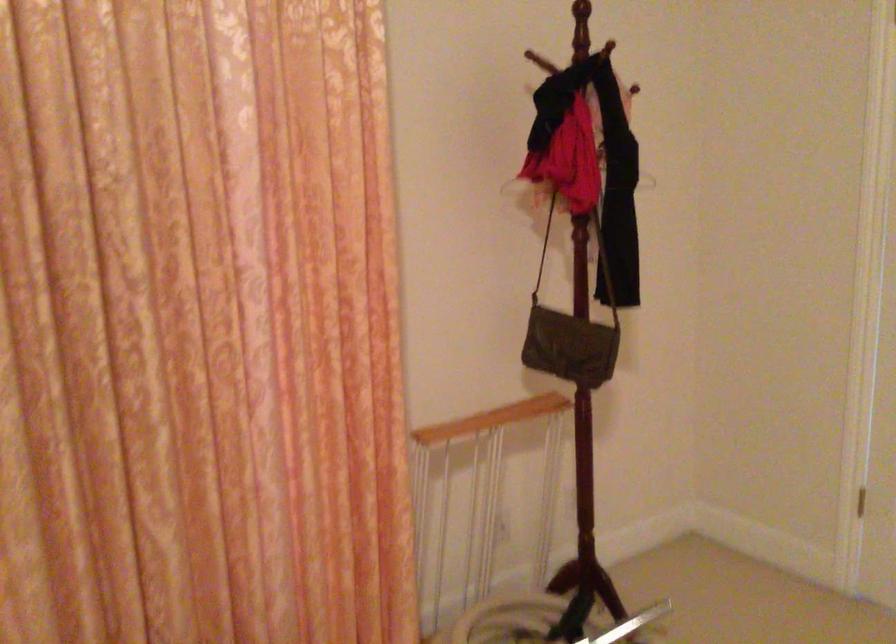
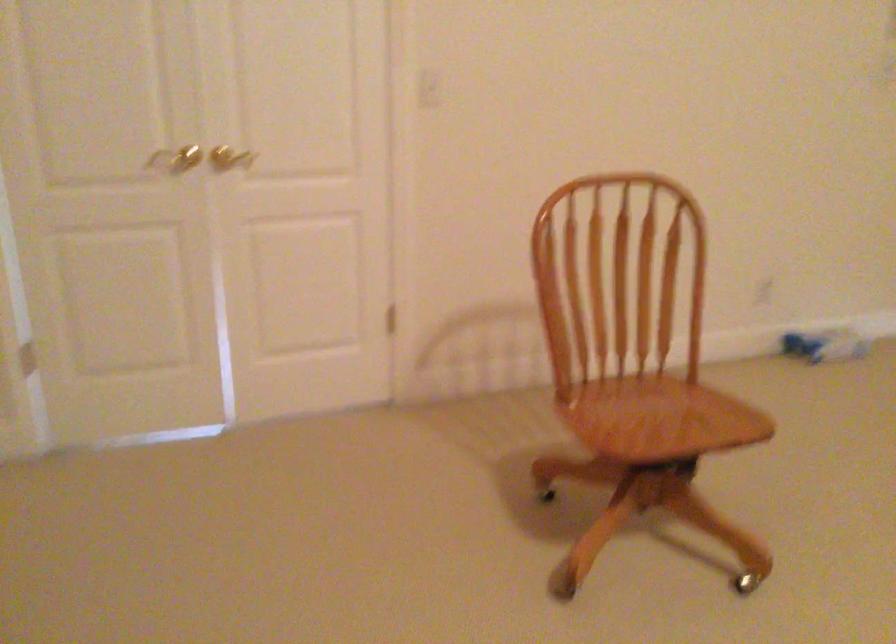
Question: The camera is either moving clockwise (left) or counter-clockwise (right) around the object. The first image is from the beginning of the video and the second image is from the end. Is the camera moving left or right when shooting the video?

Choices:
 (A) Left
 (B) Right

Answer: (A)